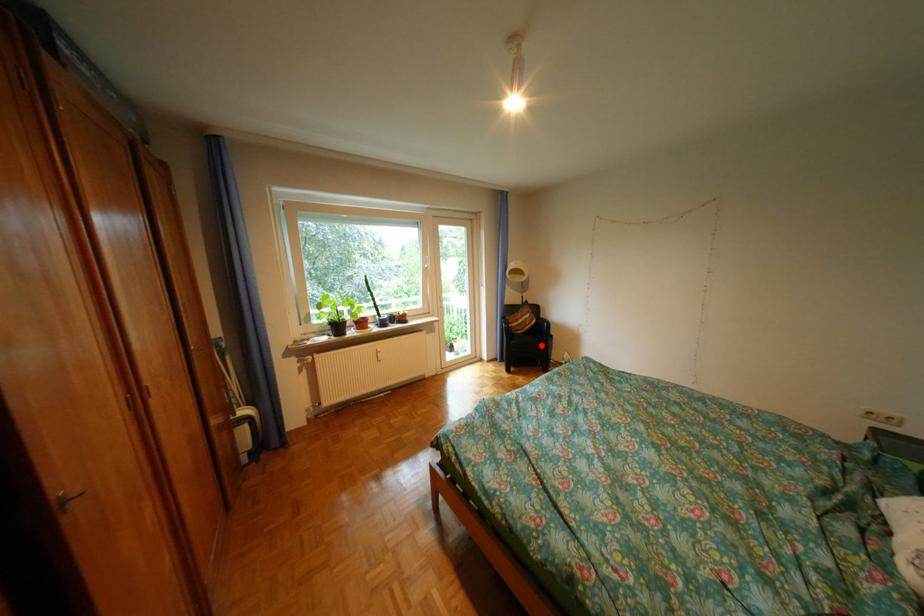
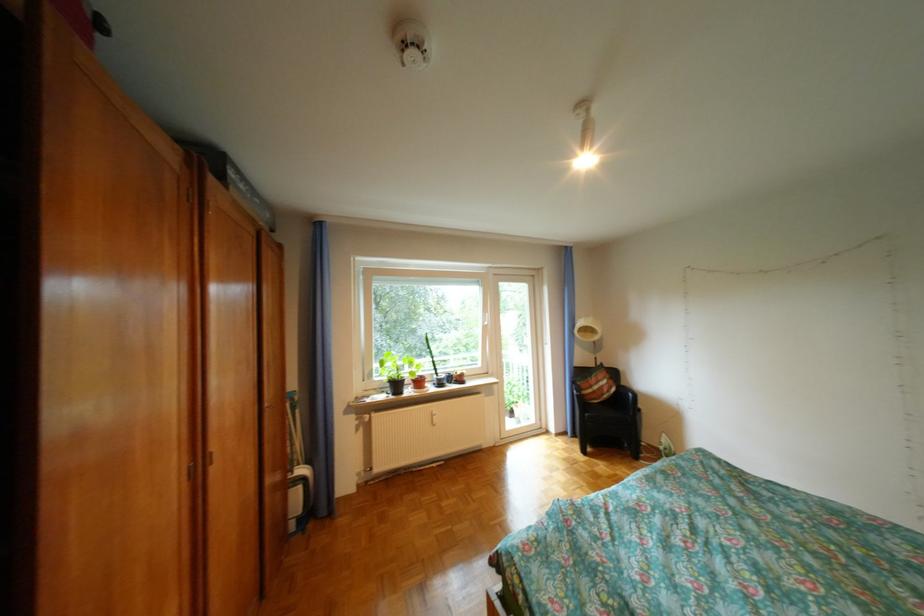
Question: I am providing you with two images of the same scene from different viewpoints. Image1 has a red point marked. In image2, the corresponding 3D location appears at what relative position? Reply with the corresponding letter.

Choices:
 (A) Closer
 (B) Farther

Answer: (B)